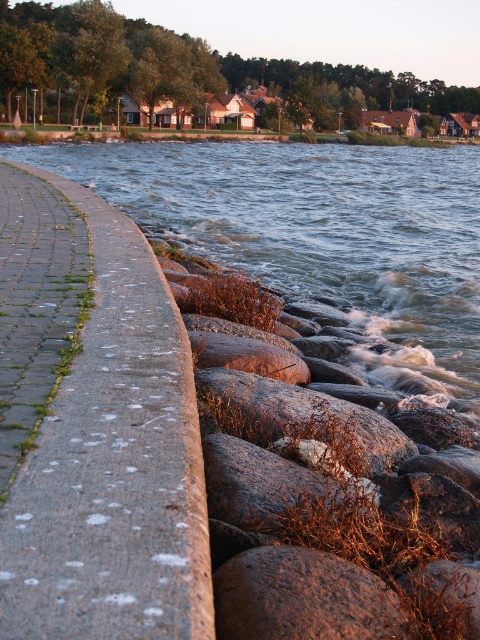
Question: Can you confirm if concrete at left is smaller than brown rough stone at lower center?

Choices:
 (A) yes
 (B) no

Answer: (B)

Question: Is clear water at lower right to the left of brown rough stone at lower center from the viewer's perspective?

Choices:
 (A) yes
 (B) no

Answer: (A)

Question: Which object is the farthest from the concrete at left?

Choices:
 (A) smooth concrete curb at center
 (B) granite rock at lower center
 (C) clear water at lower right
 (D) brown rough stone at lower center

Answer: (C)

Question: Which of these objects is positioned farthest from the smooth concrete curb at center?

Choices:
 (A) granite rock at lower center
 (B) brown rough stone at lower center
 (C) clear water at lower right

Answer: (C)

Question: Is concrete at left further to camera compared to smooth concrete curb at center?

Choices:
 (A) yes
 (B) no

Answer: (B)

Question: Which point is closer to the camera?

Choices:
 (A) (204, 580)
 (B) (385, 284)
 (C) (263, 378)
 (D) (362, 600)

Answer: (A)